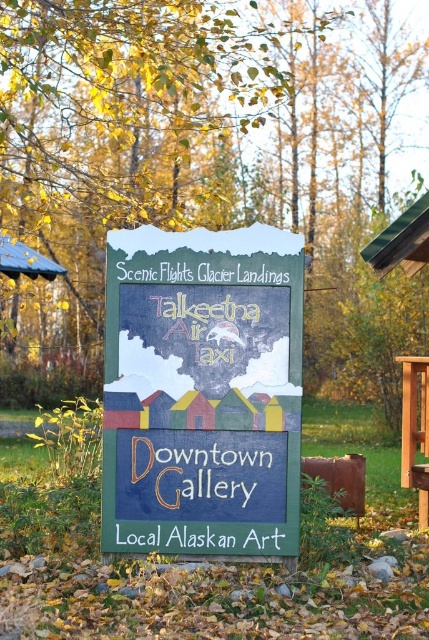
Based on the photo, you are standing in front of the wooden signboard at center and the brown wooden picnic table at right. Which object is larger in size?

The wooden signboard at center is bigger than the brown wooden picnic table at right according to the description.

Based on the photo, you are standing in a park and see the wooden signboard at center and the brown wooden picnic table at right. Which object is located to the right of the other?

The brown wooden picnic table at right is located to the right of the wooden signboard at center.